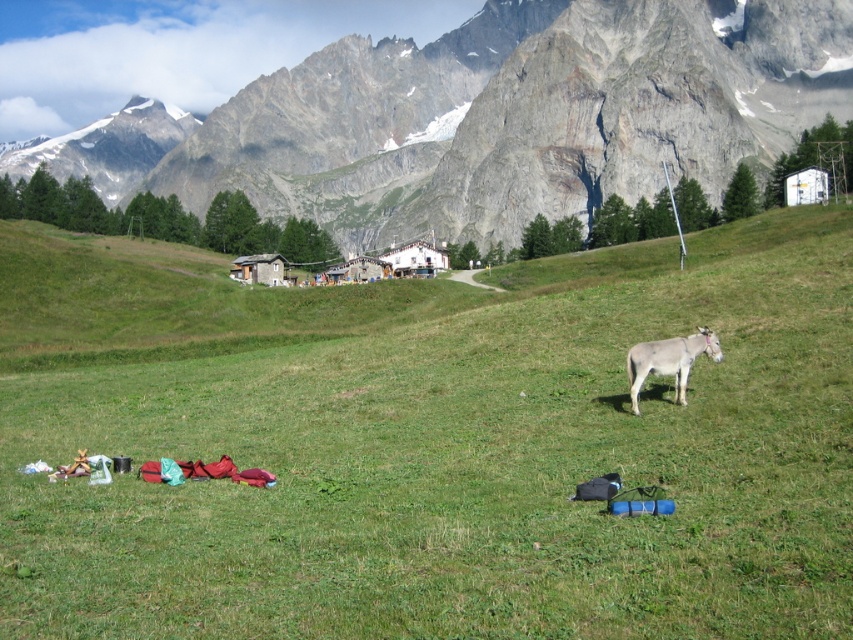
Based on the scene description, where is the green grass pasture at center located in the image?

The green grass pasture at center is located at point [438,448] in the image.

You are standing in the alpine landscape and want to walk from the white matte donkey at right to the green grass pasture at center. Which direction should you move?

To reach the green grass pasture at center from the white matte donkey at right, you should move to the left since the green grass pasture at center is located to the left of the white matte donkey at right.